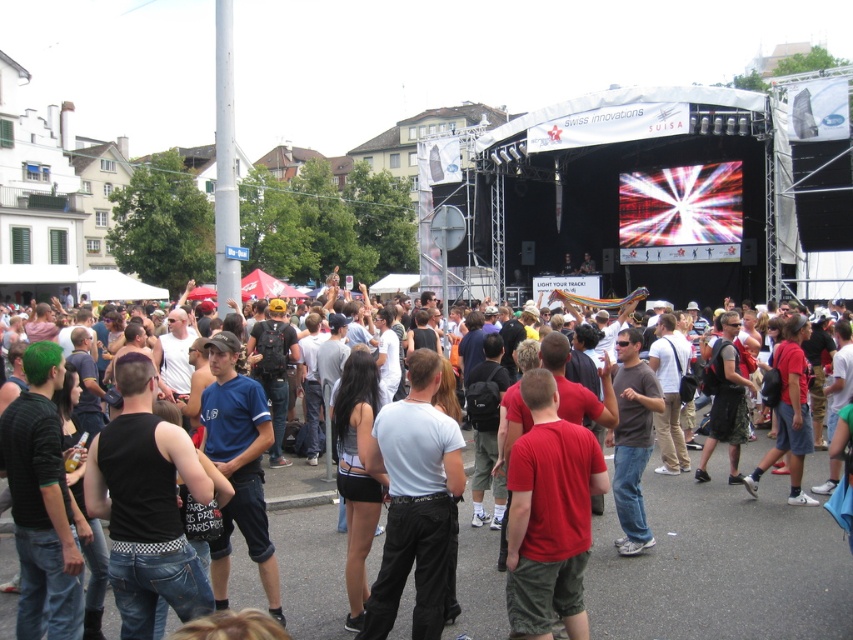
Question: Is red t-shirt at center thinner than light gray cotton t-shirt at center?

Choices:
 (A) no
 (B) yes

Answer: (A)

Question: Can you confirm if red t-shirt at center is positioned above light gray cotton t-shirt at center?

Choices:
 (A) no
 (B) yes

Answer: (A)

Question: Does red t-shirt at center appear over light gray cotton t-shirt at center?

Choices:
 (A) no
 (B) yes

Answer: (A)

Question: Which object is closer to the camera taking this photo?

Choices:
 (A) light gray cotton t-shirt at center
 (B) red t-shirt at center

Answer: (B)

Question: Which point is closer to the camera?

Choices:
 (A) light gray cotton t-shirt at center
 (B) red t-shirt at center

Answer: (B)

Question: Among these objects, which one is nearest to the camera?

Choices:
 (A) red t-shirt at center
 (B) light gray cotton t-shirt at center

Answer: (A)